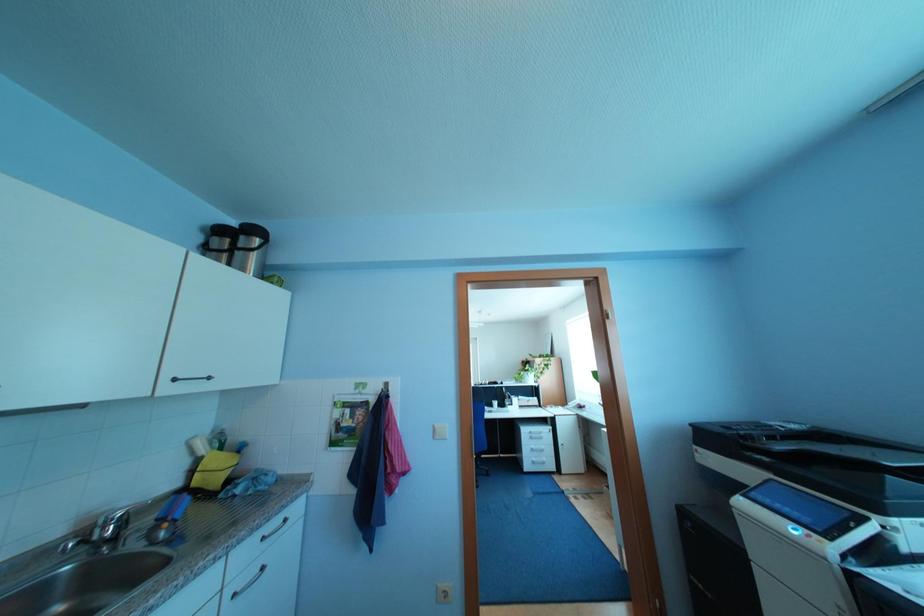
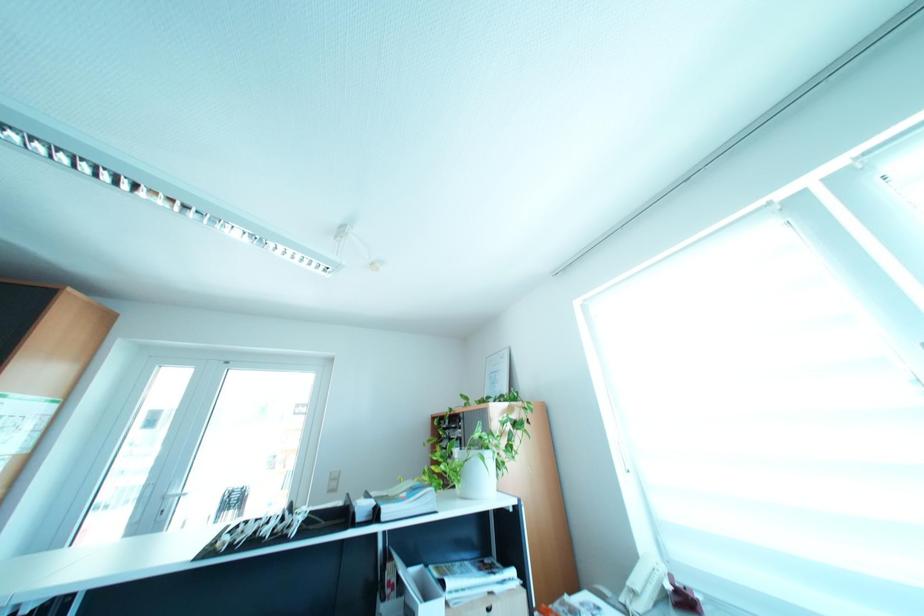
Question: Which direction would the cameraman need to move to produce the second image? Reply with the corresponding letter.

Choices:
 (A) Left
 (B) Right
 (C) Forward
 (D) Backward

Answer: (C)